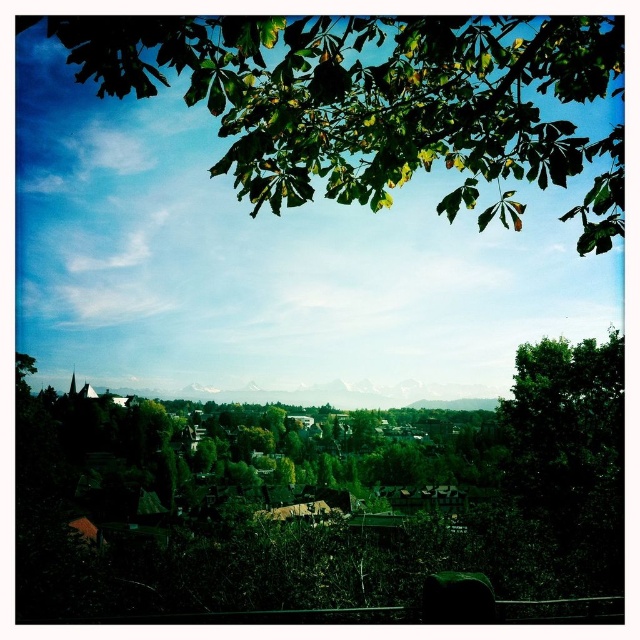
Measure the distance between green leafy tree at right and camera.

They are 105.34 feet apart.

Can you confirm if green leafy tree at right is positioned below green grassy hillside at center?

No, green leafy tree at right is not below green grassy hillside at center.

The height and width of the screenshot is (640, 640). Describe the element at coordinates (563, 422) in the screenshot. I see `green leafy tree at right` at that location.

In order to click on green leafy tree at right in this screenshot , I will do `click(563, 422)`.

Which of these two, green leafy tree at upper center or green grassy hillside at center, stands shorter?

With less height is green grassy hillside at center.

Based on the photo, who is taller, green leafy tree at upper center or green grassy hillside at center?

green leafy tree at upper center is taller.

What do you see at coordinates (374, 99) in the screenshot? I see `green leafy tree at upper center` at bounding box center [374, 99].

Image resolution: width=640 pixels, height=640 pixels. Identify the location of green leafy tree at upper center. (374, 99).

Can you confirm if green leafy tree at upper center is thinner than green leafy tree at right?

Incorrect, green leafy tree at upper center's width is not less than green leafy tree at right's.

You are a GUI agent. You are given a task and a screenshot of the screen. Output one action in this format:
    pyautogui.click(x=<x>, y=<y>)
    Task: Click on the green leafy tree at upper center
    
    Given the screenshot: What is the action you would take?
    pyautogui.click(x=374, y=99)